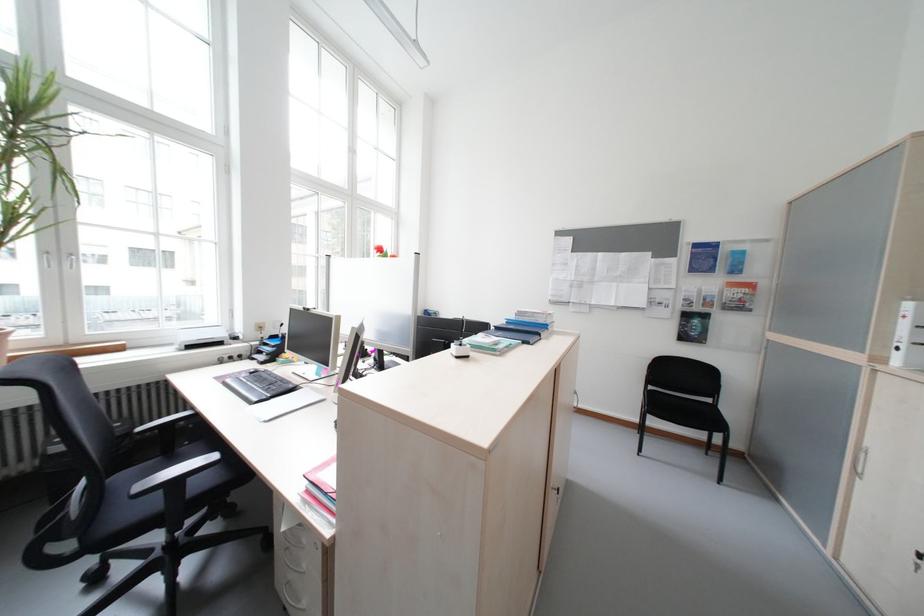
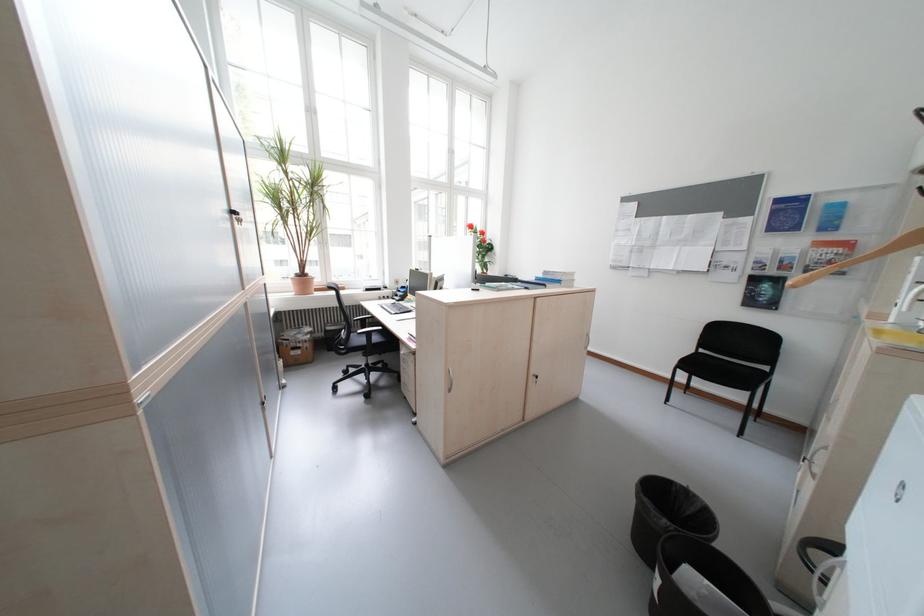
The point at (715, 318) is marked in the first image. Where is the corresponding point in the second image?

(788, 282)